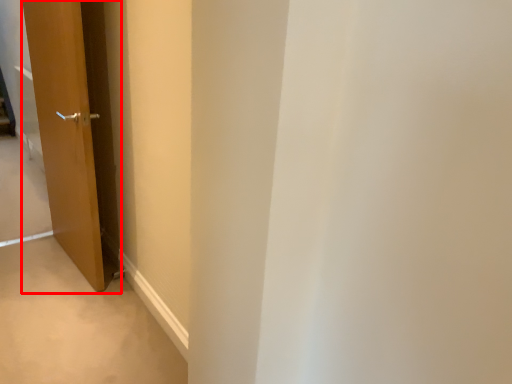
Question: Observing the image, what is the correct spatial positioning of door (annotated by the red box) in reference to path?

Choices:
 (A) left
 (B) right

Answer: (B)